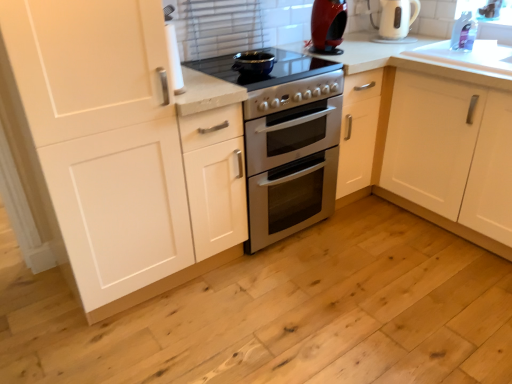
Question: Should I look upward or downward to see transparent plastic window screen at upper right?

Choices:
 (A) down
 (B) up

Answer: (B)

Question: Considering the relative sizes of white matte cabinet at left and transparent plastic window screen at upper right in the image provided, is white matte cabinet at left thinner than transparent plastic window screen at upper right?

Choices:
 (A) no
 (B) yes

Answer: (A)

Question: From a real-world perspective, is white matte cabinet at left on transparent plastic window screen at upper right?

Choices:
 (A) yes
 (B) no

Answer: (B)

Question: Does white matte cabinet at left have a larger size compared to transparent plastic window screen at upper right?

Choices:
 (A) no
 (B) yes

Answer: (B)

Question: Can you confirm if white matte cabinet at left is positioned to the right of transparent plastic window screen at upper right?

Choices:
 (A) yes
 (B) no

Answer: (B)

Question: Is white matte cabinet at left outside transparent plastic window screen at upper right?

Choices:
 (A) no
 (B) yes

Answer: (B)

Question: Considering the relative sizes of white matte cabinet at left and transparent plastic window screen at upper right in the image provided, is white matte cabinet at left wider than transparent plastic window screen at upper right?

Choices:
 (A) no
 (B) yes

Answer: (B)

Question: Can you confirm if transparent plastic window screen at upper right is wider than white glossy electric kettle at upper right?

Choices:
 (A) no
 (B) yes

Answer: (A)

Question: Is transparent plastic window screen at upper right shorter than white glossy electric kettle at upper right?

Choices:
 (A) no
 (B) yes

Answer: (B)

Question: Is transparent plastic window screen at upper right positioned with its back to white glossy electric kettle at upper right?

Choices:
 (A) yes
 (B) no

Answer: (B)

Question: Does transparent plastic window screen at upper right have a larger size compared to white glossy electric kettle at upper right?

Choices:
 (A) yes
 (B) no

Answer: (B)

Question: Is transparent plastic window screen at upper right oriented towards white glossy electric kettle at upper right?

Choices:
 (A) yes
 (B) no

Answer: (B)

Question: Could white glossy electric kettle at upper right be considered to be inside transparent plastic window screen at upper right?

Choices:
 (A) no
 (B) yes

Answer: (A)

Question: Is white glossy oven at center, marked as the 2th appliance in a top-to-bottom arrangement, smaller than white matte cabinet at left?

Choices:
 (A) no
 (B) yes

Answer: (B)